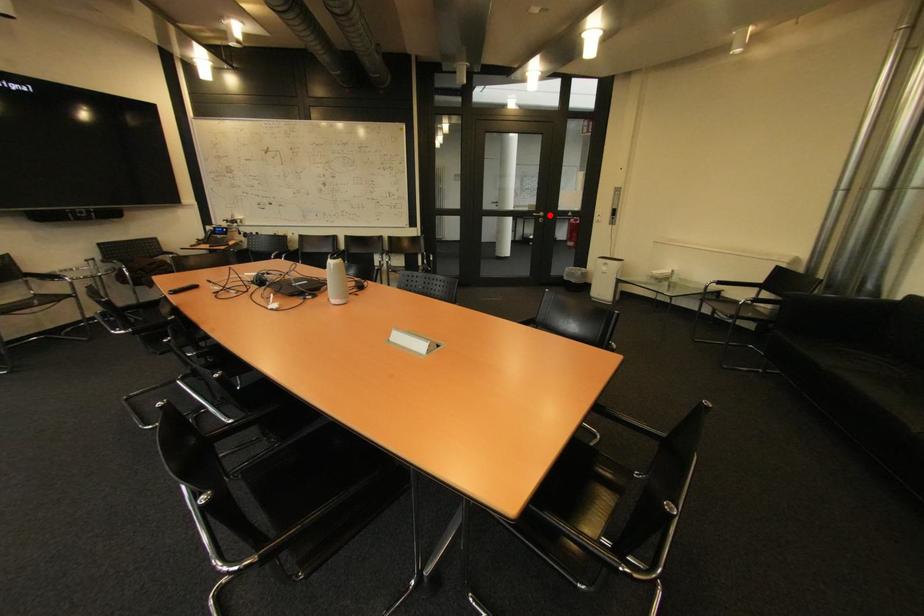
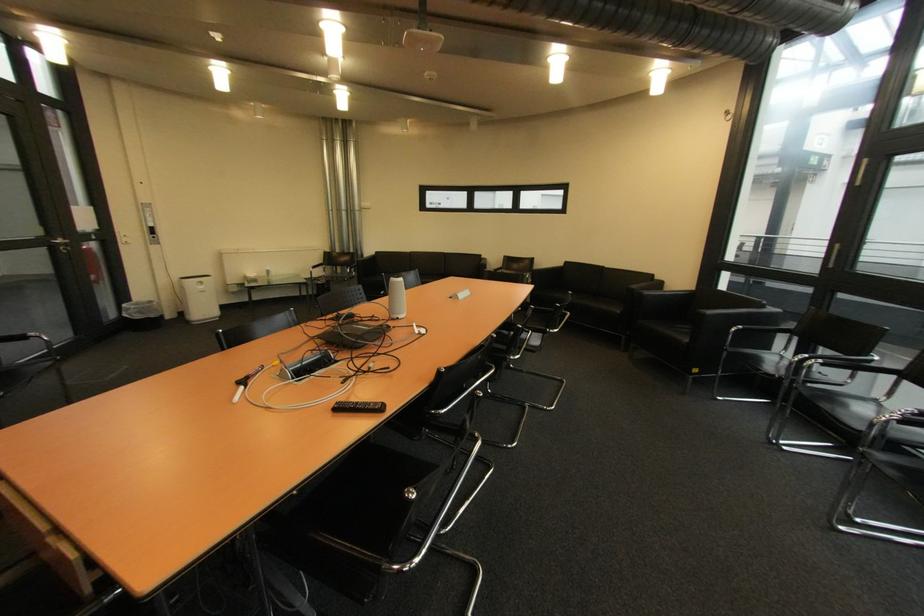
Where in the second image is the point corresponding to the highlighted location from the first image?

(68, 241)